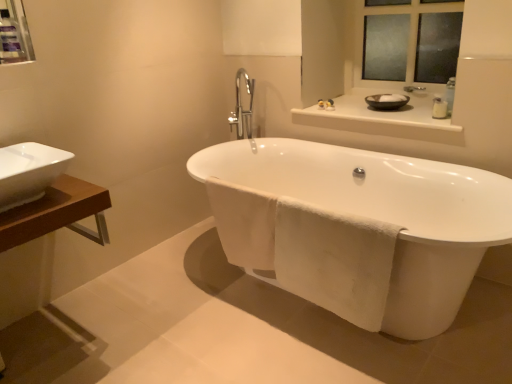
Question: Can you confirm if matte plastic medicine cabinet at upper left is thinner than white glossy bathtub at center?

Choices:
 (A) yes
 (B) no

Answer: (A)

Question: From a real-world perspective, is matte plastic medicine cabinet at upper left on top of white glossy bathtub at center?

Choices:
 (A) yes
 (B) no

Answer: (A)

Question: Does matte plastic medicine cabinet at upper left have a lesser height compared to white glossy bathtub at center?

Choices:
 (A) no
 (B) yes

Answer: (B)

Question: Considering the relative sizes of matte plastic medicine cabinet at upper left and white glossy bathtub at center in the image provided, is matte plastic medicine cabinet at upper left bigger than white glossy bathtub at center?

Choices:
 (A) yes
 (B) no

Answer: (B)

Question: Can you confirm if matte plastic medicine cabinet at upper left is wider than white glossy bathtub at center?

Choices:
 (A) yes
 (B) no

Answer: (B)

Question: Considering the relative positions of white ceramic sink at left and matte plastic medicine cabinet at upper left in the image provided, is white ceramic sink at left to the left or to the right of matte plastic medicine cabinet at upper left?

Choices:
 (A) right
 (B) left

Answer: (A)

Question: From the image's perspective, is white ceramic sink at left above or below matte plastic medicine cabinet at upper left?

Choices:
 (A) above
 (B) below

Answer: (B)

Question: Relative to matte plastic medicine cabinet at upper left, is white ceramic sink at left in front or behind?

Choices:
 (A) behind
 (B) front

Answer: (B)

Question: Is white ceramic sink at left inside the boundaries of matte plastic medicine cabinet at upper left, or outside?

Choices:
 (A) inside
 (B) outside

Answer: (B)

Question: Relative to glossy ceramic mirror at upper center, is white plastic bottle at upper right in front or behind?

Choices:
 (A) behind
 (B) front

Answer: (B)

Question: Do you think white plastic bottle at upper right is within glossy ceramic mirror at upper center, or outside of it?

Choices:
 (A) inside
 (B) outside

Answer: (B)

Question: Is point (440, 97) closer or farther from the camera than point (442, 77)?

Choices:
 (A) farther
 (B) closer

Answer: (A)

Question: From the image's perspective, is white plastic bottle at upper right located above or below glossy ceramic mirror at upper center?

Choices:
 (A) below
 (B) above

Answer: (A)

Question: From their relative heights in the image, would you say white ceramic sink at left is taller or shorter than white glossy counter top at upper center?

Choices:
 (A) short
 (B) tall

Answer: (B)

Question: Is white ceramic sink at left in front of or behind white glossy counter top at upper center in the image?

Choices:
 (A) front
 (B) behind

Answer: (A)